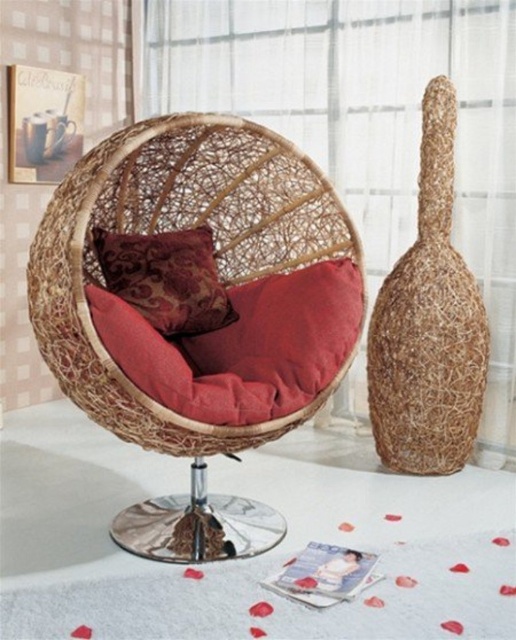
Question: Does woven rattan armchair at center have a greater width compared to velvet-like burgundy pillow at center?

Choices:
 (A) no
 (B) yes

Answer: (B)

Question: Which point appears closest to the camera in this image?

Choices:
 (A) (205, 248)
 (B) (103, 282)

Answer: (A)

Question: Observing the image, what is the correct spatial positioning of woven rattan armchair at center in reference to velvet-like burgundy pillow at center?

Choices:
 (A) left
 (B) right

Answer: (B)

Question: Among these points, which one is farthest from the camera?

Choices:
 (A) (135, 145)
 (B) (168, 333)

Answer: (B)

Question: Which object appears farthest from the camera in this image?

Choices:
 (A) woven rattan armchair at center
 (B) velvet-like burgundy pillow at center

Answer: (B)

Question: Does woven rattan armchair at center have a lesser width compared to velvet-like burgundy pillow at center?

Choices:
 (A) yes
 (B) no

Answer: (B)